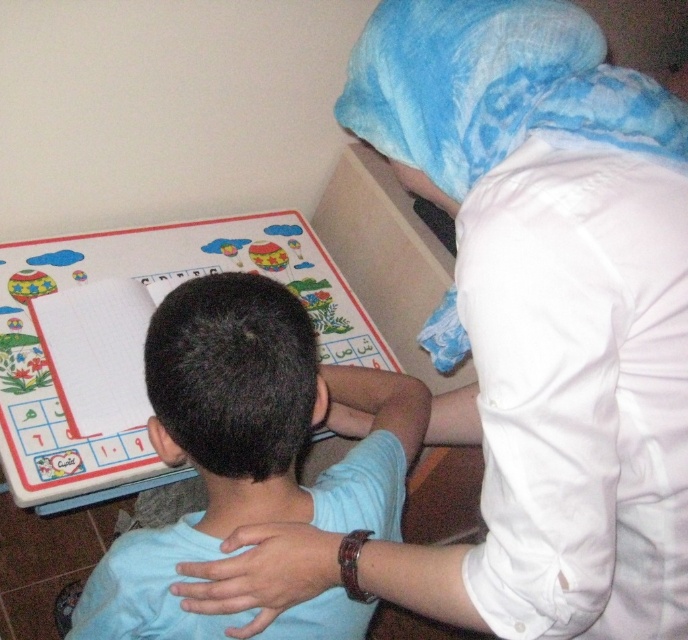
Who is lower down, light blue shirt at center or blue fabric at upper right?

Positioned lower is light blue shirt at center.

Does point (211, 401) come behind point (493, 0)?

Yes, point (211, 401) is farther from viewer.

Find the location of `light blue shirt at center`. light blue shirt at center is located at coordinates (247, 445).